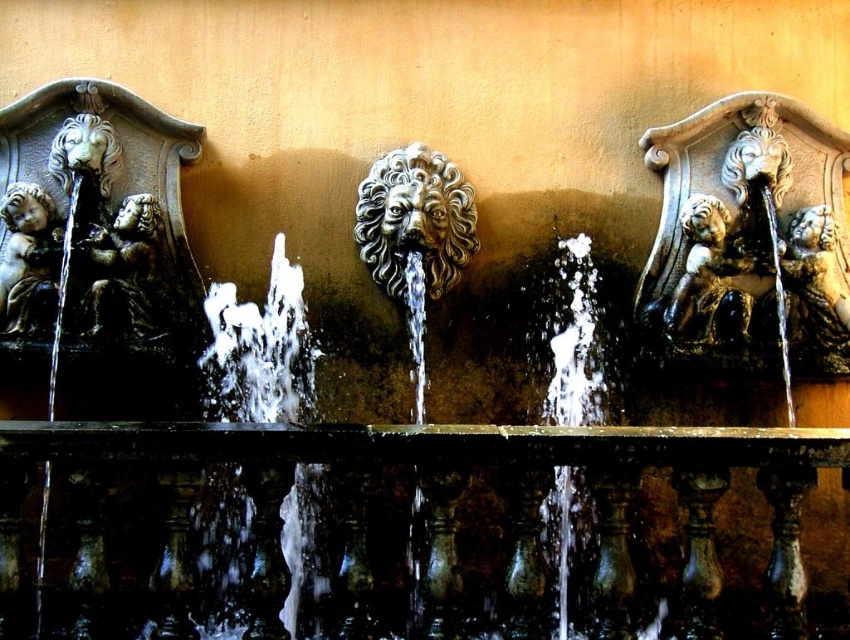
Is bronze balustrade at center positioned at the back of bronze cherub at right?

No.

Can you confirm if bronze balustrade at center is taller than bronze cherub at right?

No.

Image resolution: width=850 pixels, height=640 pixels. Describe the element at coordinates (434, 442) in the screenshot. I see `bronze balustrade at center` at that location.

Where is `bronze balustrade at center`? The height and width of the screenshot is (640, 850). bronze balustrade at center is located at coordinates point(434,442).

Is point (561, 328) positioned before point (9, 216)?

No, it is behind (9, 216).

Which is behind, point (548, 344) or point (34, 202)?

Point (548, 344)

At what (x,y) coordinates should I click in order to perform the action: click on clear water at center. Please return your answer as a coordinate pair (x, y). The width and height of the screenshot is (850, 640). Looking at the image, I should click on (575, 340).

Is clear water at center bigger than bronze cherub at right?

No.

Does point (574, 328) lie in front of point (779, 266)?

No, it is not.

This screenshot has width=850, height=640. I want to click on clear water at center, so click(x=575, y=340).